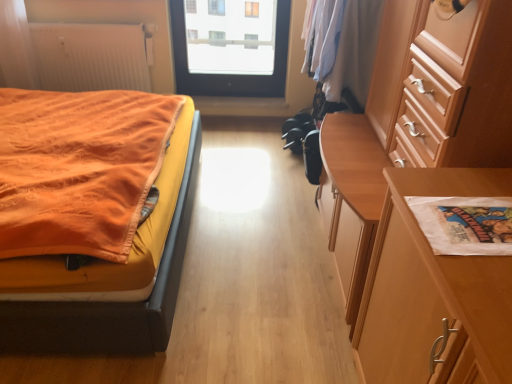
This screenshot has width=512, height=384. What do you see at coordinates (465, 224) in the screenshot?
I see `white paper at right` at bounding box center [465, 224].

This screenshot has width=512, height=384. Describe the element at coordinates (228, 56) in the screenshot. I see `transparent glass door at upper center` at that location.

The image size is (512, 384). What do you see at coordinates (433, 288) in the screenshot?
I see `white paper bag at right` at bounding box center [433, 288].

Describe the element at coordinates (109, 276) in the screenshot. This screenshot has width=512, height=384. I see `orange fabric bed at left` at that location.

At what (x,y) coordinates should I click in order to perform the action: click on white paper at right. Please return your answer as a coordinate pair (x, y). The height and width of the screenshot is (384, 512). Looking at the image, I should click on (465, 224).

Is wooden chest of drawers at right a part of transparent glass door at upper center?

No, transparent glass door at upper center does not contain wooden chest of drawers at right.

Considering the relative sizes of transparent glass door at upper center and wooden chest of drawers at right in the image provided, is transparent glass door at upper center smaller than wooden chest of drawers at right?

Correct, transparent glass door at upper center occupies less space than wooden chest of drawers at right.

Measure the distance between transparent glass door at upper center and wooden chest of drawers at right.

A distance of 6.30 feet exists between transparent glass door at upper center and wooden chest of drawers at right.

Considering the positions of objects transparent glass door at upper center and wooden chest of drawers at right in the image provided, who is more to the right, transparent glass door at upper center or wooden chest of drawers at right?

wooden chest of drawers at right.

Is transparent glass door at upper center aimed at white ribbed radiator at upper left?

No, transparent glass door at upper center is not aimed at white ribbed radiator at upper left.

From the image's perspective, relative to white ribbed radiator at upper left, is transparent glass door at upper center above or below?

transparent glass door at upper center is situated higher than white ribbed radiator at upper left in the image.

How many degrees apart are the facing directions of transparent glass door at upper center and white ribbed radiator at upper left?

The angular difference between transparent glass door at upper center and white ribbed radiator at upper left is 0.0399 degrees.

Is transparent glass door at upper center not within white paper bag at right?

transparent glass door at upper center is positioned outside white paper bag at right.

Which of these two, transparent glass door at upper center or white paper bag at right, is smaller?

Smaller between the two is transparent glass door at upper center.

In terms of width, does transparent glass door at upper center look wider or thinner when compared to white paper bag at right?

Considering their sizes, transparent glass door at upper center looks slimmer than white paper bag at right.

From the image's perspective, would you say transparent glass door at upper center is positioned over white paper bag at right?

Indeed, from the image's perspective, transparent glass door at upper center is shown above white paper bag at right.

Is white ribbed radiator at upper left directly adjacent to white paper at right?

white ribbed radiator at upper left and white paper at right are not in contact.

Who is bigger, white ribbed radiator at upper left or white paper at right?

white ribbed radiator at upper left.

Could you tell me if white ribbed radiator at upper left is facing white paper at right?

Yes.

You are a GUI agent. You are given a task and a screenshot of the screen. Output one action in this format:
    pyautogui.click(x=<x>, y=<y>)
    Task: Click on the chest of drawers that appears below the white paper at right (from a real-world perspective)
    The height and width of the screenshot is (384, 512).
    Given the screenshot: What is the action you would take?
    pyautogui.click(x=415, y=123)

From the image's perspective, which is below, wooden chest of drawers at right or white paper at right?

white paper at right.

Are wooden chest of drawers at right and white paper at right making contact?

There is a gap between wooden chest of drawers at right and white paper at right.

Is point (449, 81) positioned after point (502, 213)?

Yes, it is.

How far apart are white ribbed radiator at upper left and transparent glass door at upper center?

white ribbed radiator at upper left and transparent glass door at upper center are 27.26 inches apart from each other.

Would you say white ribbed radiator at upper left is a long distance from transparent glass door at upper center?

white ribbed radiator at upper left is actually quite close to transparent glass door at upper center.

Is transparent glass door at upper center completely or partially inside white ribbed radiator at upper left?

No, transparent glass door at upper center is not inside white ribbed radiator at upper left.

Find the location of a particular element. Image resolution: width=512 pixels, height=384 pixels. radiator located in front of the transparent glass door at upper center is located at coordinates (92, 56).

Is wooden chest of drawers at right facing away from white ribbed radiator at upper left?

No, white ribbed radiator at upper left is not at the back of wooden chest of drawers at right.

From the image's perspective, between wooden chest of drawers at right and white ribbed radiator at upper left, who is located below?

wooden chest of drawers at right appears lower in the image.

Which object is more forward, wooden chest of drawers at right or white ribbed radiator at upper left?

wooden chest of drawers at right is in front.

Which is more to the left, wooden chest of drawers at right or white ribbed radiator at upper left?

white ribbed radiator at upper left is more to the left.

Find the location of a particular element. The height and width of the screenshot is (384, 512). door lying behind the wooden chest of drawers at right is located at coordinates (228, 56).

Find the location of `radiator below the transparent glass door at upper center (from the image's perspective)`. radiator below the transparent glass door at upper center (from the image's perspective) is located at coordinates (92, 56).

Which object lies further to the anchor point white paper at right, orange fabric bed at left or wooden chest of drawers at right?

orange fabric bed at left lies further to white paper at right than the other object.

Estimate the real-world distances between objects in this image. Which object is further from wooden chest of drawers at right, orange fabric bed at left or white paper bag at right?

Among the two, orange fabric bed at left is located further to wooden chest of drawers at right.

Based on their spatial positions, is orange fabric bed at left or transparent glass door at upper center further from white ribbed radiator at upper left?

orange fabric bed at left is positioned further to the anchor white ribbed radiator at upper left.

From the image, which object appears to be farther from transparent glass door at upper center, orange fabric bed at left or white paper at right?

white paper at right is further to transparent glass door at upper center.

Which object lies further to the anchor point transparent glass door at upper center, wooden chest of drawers at right or orange fabric bed at left?

wooden chest of drawers at right.

Looking at the image, which one is located closer to orange fabric bed at left, white paper bag at right or white paper at right?

Based on the image, white paper bag at right appears to be nearer to orange fabric bed at left.

From the image, which object appears to be nearer to transparent glass door at upper center, white ribbed radiator at upper left or white paper at right?

Based on the image, white ribbed radiator at upper left appears to be nearer to transparent glass door at upper center.

From the image, which object appears to be farther from white paper at right, white ribbed radiator at upper left or orange fabric bed at left?

white ribbed radiator at upper left is positioned further to the anchor white paper at right.

I want to click on radiator between wooden chest of drawers at right and transparent glass door at upper center in the front-back direction, so click(x=92, y=56).

Image resolution: width=512 pixels, height=384 pixels. Identify the location of chest of drawers between white paper bag at right and transparent glass door at upper center along the z-axis. (x=415, y=123).

This screenshot has height=384, width=512. What are the coordinates of `linen between orange fabric bed at left and wooden chest of drawers at right from left to right` in the screenshot? It's located at (465, 224).

I want to click on radiator positioned between orange fabric bed at left and transparent glass door at upper center from near to far, so click(x=92, y=56).